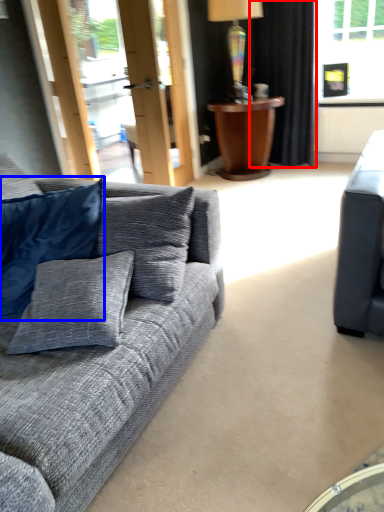
Question: Which of the following is the farthest to the observer, curtain (highlighted by a red box) or pillow (highlighted by a blue box)?

Choices:
 (A) curtain
 (B) pillow

Answer: (A)